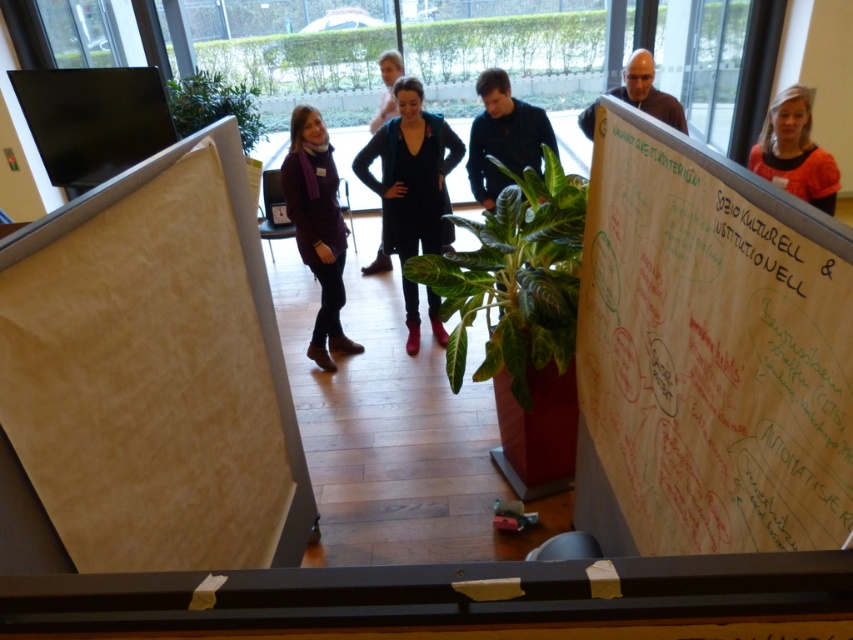
Question: Is velvet black dress at center bigger than white paperboard at upper center?

Choices:
 (A) yes
 (B) no

Answer: (A)

Question: Does whiteboard at right appear over matte purple sweater at center?

Choices:
 (A) yes
 (B) no

Answer: (B)

Question: Which of the following is the farthest from the observer?

Choices:
 (A) (312, 253)
 (B) (171, 84)
 (C) (805, 116)
 (D) (640, 90)

Answer: (B)

Question: Which of the following is the farthest from the observer?

Choices:
 (A) (498, 106)
 (B) (778, 236)

Answer: (A)

Question: Can you confirm if whiteboard at right is positioned to the left of orange matte shirt at upper right?

Choices:
 (A) yes
 (B) no

Answer: (A)

Question: Which of these objects is positioned closest to the green glossy plant at center?

Choices:
 (A) white chalk writing at upper center
 (B) dark blue shirt at center
 (C) white paperboard at upper center

Answer: (A)